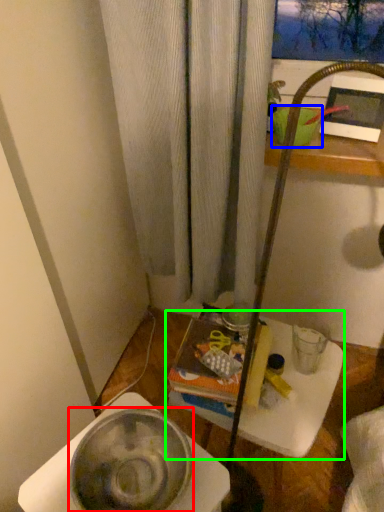
Question: Which is nearer to the basin (highlighted by a red box)? basin (highlighted by a blue box) or table (highlighted by a green box).

Choices:
 (A) basin
 (B) table

Answer: (B)